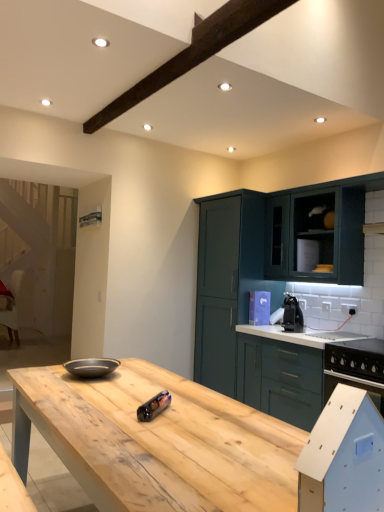
Question: Is matte dark teal cabinet at upper right, marked as the second cabinetry in a back-to-front arrangement, taller or shorter than black plastic coffee machine at center, placed as the first appliance when sorted from top to bottom?

Choices:
 (A) tall
 (B) short

Answer: (A)

Question: Is point (304, 199) positioned closer to the camera than point (299, 329)?

Choices:
 (A) farther
 (B) closer

Answer: (A)

Question: Which is farther from the black plastic coffee machine at center, the second appliance ordered from the bottom?

Choices:
 (A) matte dark teal cabinet at upper right, which appears as the 2th cabinetry when viewed from the front
 (B) white fabric chair at left
 (C) metallic cylindrical can at center, the 1th appliance in the front-to-back sequence
 (D) teal matte cabinet at upper right, the third cabinetry when ordered from front to back
 (E) green matte cabinet at right, marked as the first cabinetry in a front-to-back arrangement

Answer: (B)

Question: Which object is the closest to the metallic cylindrical can at center, the 1th appliance in the front-to-back sequence?

Choices:
 (A) green matte cabinet at right, which appears as the third cabinetry when viewed from the back
 (B) natural wood table at center
 (C) matte dark teal cabinet at upper right, marked as the second cabinetry in a back-to-front arrangement
 (D) white fabric chair at left
 (E) black plastic coffee machine at center, which is counted as the 2th appliance, starting from the front

Answer: (B)